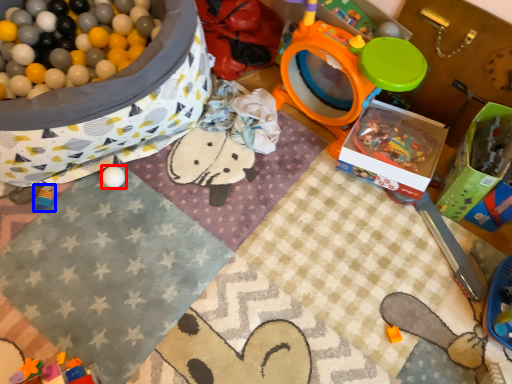
Question: Which point is further to the camera, toy (highlighted by a red box) or toy (highlighted by a blue box)?

Choices:
 (A) toy
 (B) toy

Answer: (A)